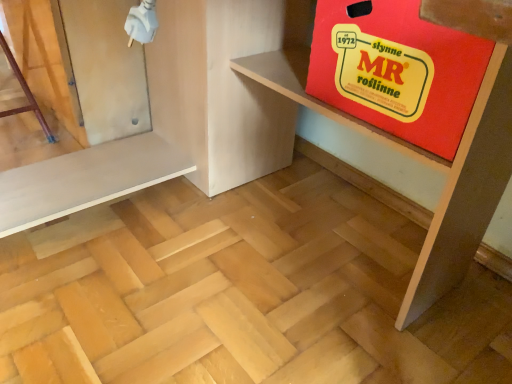
The width and height of the screenshot is (512, 384). What do you see at coordinates (397, 70) in the screenshot?
I see `red cardboard box at upper right` at bounding box center [397, 70].

Image resolution: width=512 pixels, height=384 pixels. I want to click on red cardboard box at upper right, so click(x=397, y=70).

Find the location of `red cardboard box at upper right`. red cardboard box at upper right is located at coordinates (397, 70).